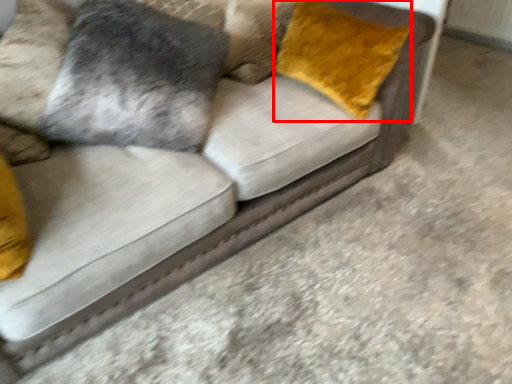
Question: Considering the relative positions of throw pillow (annotated by the red box) and pillow in the image provided, where is throw pillow (annotated by the red box) located with respect to the staircase?

Choices:
 (A) left
 (B) right

Answer: (B)